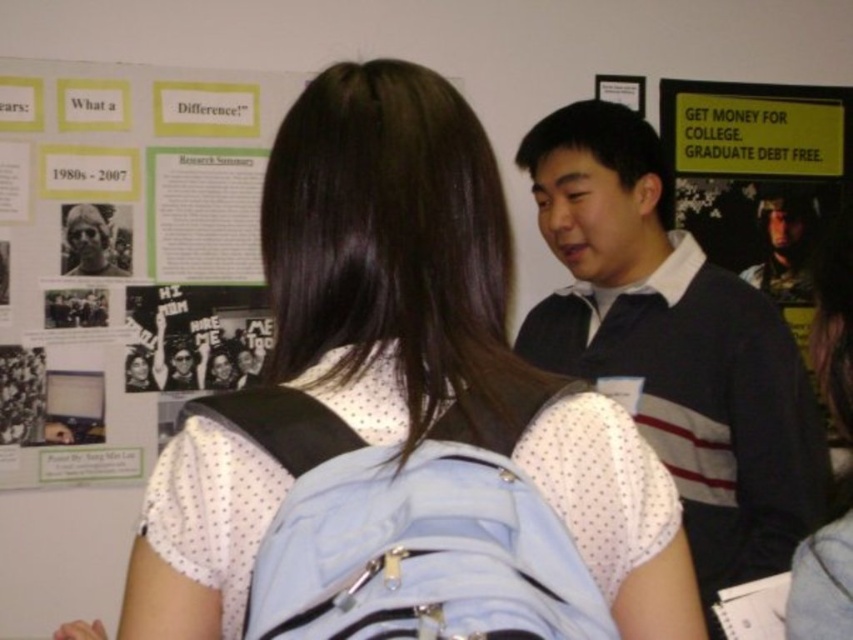
Question: In this image, where is dark gray sweater at right located relative to matte black shirt at right?

Choices:
 (A) right
 (B) left

Answer: (B)

Question: Which object appears closest to the camera in this image?

Choices:
 (A) light blue fabric backpack at center
 (B) matte black shirt at right
 (C) dark gray sweater at right
 (D) white paper poster at upper left

Answer: (A)

Question: Among these points, which one is farthest from the camera?

Choices:
 (A) (740, 452)
 (B) (90, 257)

Answer: (B)

Question: Which of these objects is positioned farthest from the matte black hair at upper left?

Choices:
 (A) dark gray sweater at right
 (B) white paper poster at upper left
 (C) white dotted shirt at upper center
 (D) matte black shirt at right

Answer: (D)

Question: Can you confirm if light blue fabric backpack at center is bigger than matte black hair at upper left?

Choices:
 (A) no
 (B) yes

Answer: (B)

Question: Is white dotted shirt at upper center above dark gray sweater at right?

Choices:
 (A) yes
 (B) no

Answer: (A)